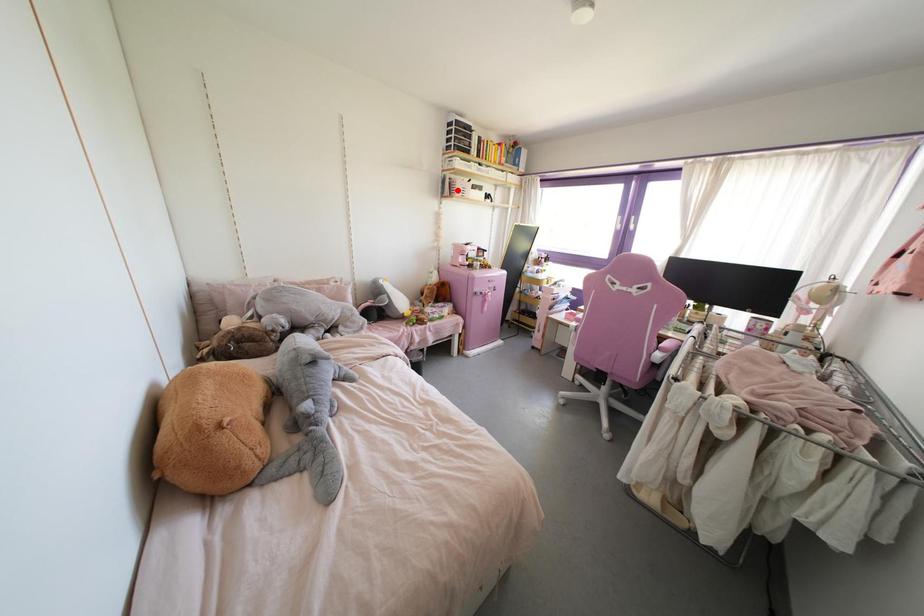
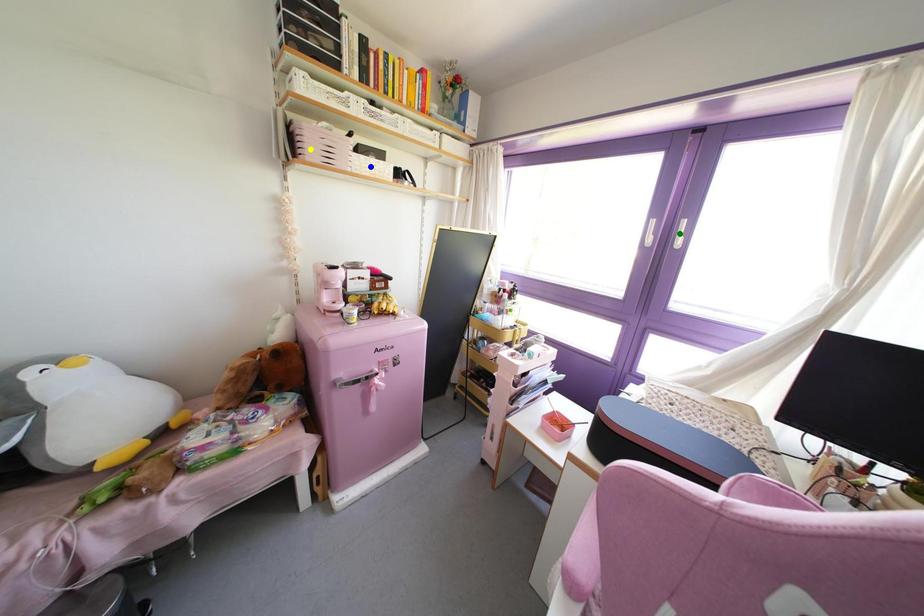
Question: I am providing you with two images of the same scene from different viewpoints. A red point is marked on the first image. You are given multiple points on the second image. In image 2, which mark is for the same physical point as the one in image 1?

Choices:
 (A) green point
 (B) blue point
 (C) yellow point

Answer: (C)